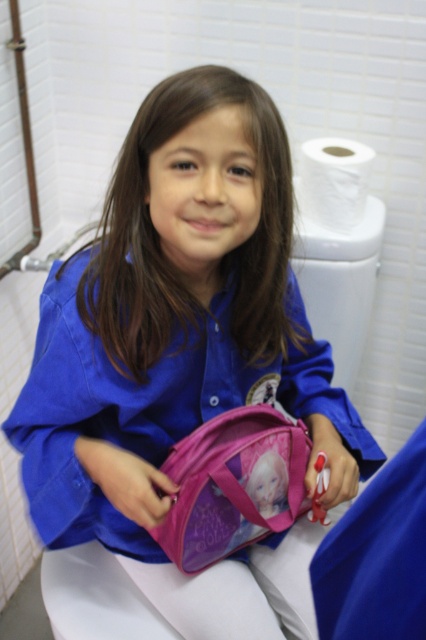
Can you confirm if pink fabric scrub at lower right is thinner than white matte toilet paper at upper right?

Correct, pink fabric scrub at lower right's width is less than white matte toilet paper at upper right's.

Image resolution: width=426 pixels, height=640 pixels. I want to click on pink fabric scrub at lower right, so click(x=377, y=556).

Between pink fabric backpack at lower center and pink fabric scrub at lower right, which one is positioned lower?

Positioned lower is pink fabric backpack at lower center.

Measure the distance between pink fabric backpack at lower center and pink fabric scrub at lower right.

pink fabric backpack at lower center is 14.25 inches away from pink fabric scrub at lower right.

Between point (255, 470) and point (414, 474), which one is positioned behind?

Point (255, 470)

Image resolution: width=426 pixels, height=640 pixels. In order to click on pink fabric backpack at lower center in this screenshot , I will do `click(233, 484)`.

Is point (183, 502) less distant than point (310, 150)?

Yes, it is.

Is pink fabric backpack at lower center bigger than white matte toilet paper at upper right?

Yes.

Is point (230, 481) positioned before point (339, 205)?

Yes, it is in front of point (339, 205).

Find the location of a particular element. Image resolution: width=426 pixels, height=640 pixels. pink fabric backpack at lower center is located at coordinates (233, 484).